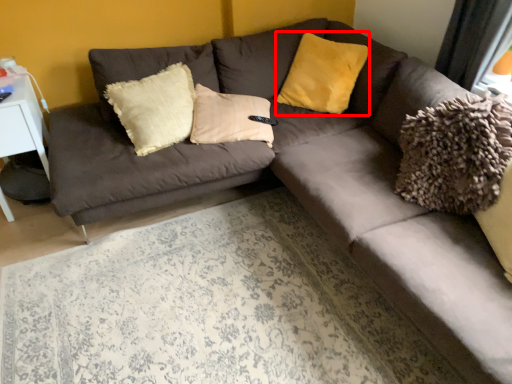
Question: Considering the relative positions of pillow (annotated by the red box) and table in the image provided, where is pillow (annotated by the red box) located with respect to the staircase?

Choices:
 (A) left
 (B) right

Answer: (B)